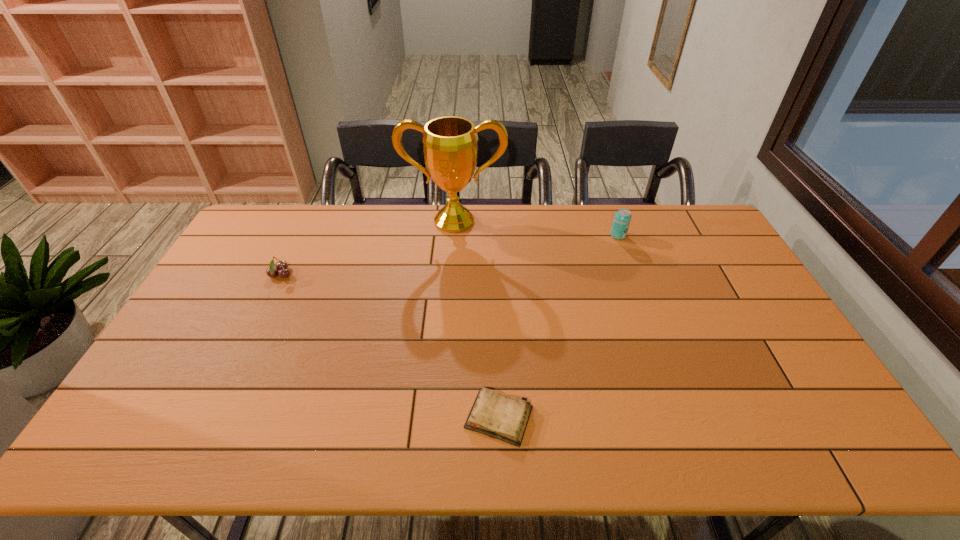
Find the location of a particular element. This screenshot has width=960, height=540. free spot located 0.340m on the back of the nearest object is located at coordinates (494, 295).

Locate an element on the screen. The height and width of the screenshot is (540, 960). award located in the far edge section of the desktop is located at coordinates pos(450,146).

Identify the location of beer can that is at the far edge. (622, 218).

Locate an element on the screen. The width and height of the screenshot is (960, 540). object present at the near edge is located at coordinates (498, 416).

This screenshot has height=540, width=960. What are the coordinates of `free point at the far edge` in the screenshot? It's located at (392, 205).

The image size is (960, 540). I want to click on free space at the near edge, so click(x=355, y=453).

The width and height of the screenshot is (960, 540). In the image, there is a desktop. Identify the location of free space at the left edge. (242, 246).

Find the location of a particular element. blank space at the right edge of the desktop is located at coordinates (724, 248).

The image size is (960, 540). In the image, there is a desktop. What are the coordinates of `vacant space at the far right corner` in the screenshot? It's located at (708, 238).

Locate an element on the screen. Image resolution: width=960 pixels, height=540 pixels. free space at the near right corner of the desktop is located at coordinates (780, 433).